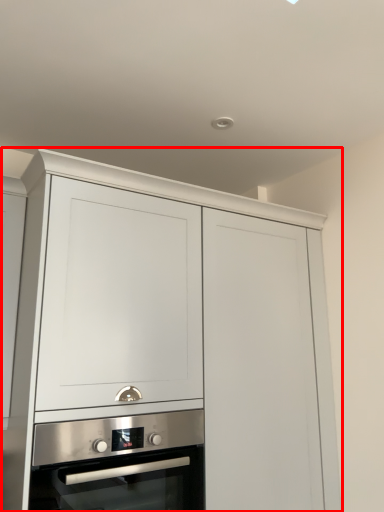
Question: From the image's perspective, what is the correct spatial relationship of cabinetry (annotated by the red box) in relation to oven?

Choices:
 (A) below
 (B) above

Answer: (B)